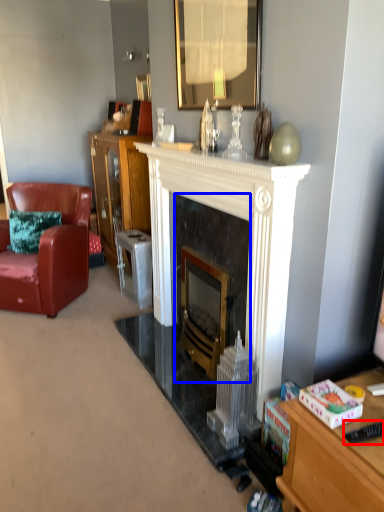
Question: Among these objects, which one is nearest to the camera, remote control (highlighted by a red box) or fireplace (highlighted by a blue box)?

Choices:
 (A) remote control
 (B) fireplace

Answer: (A)